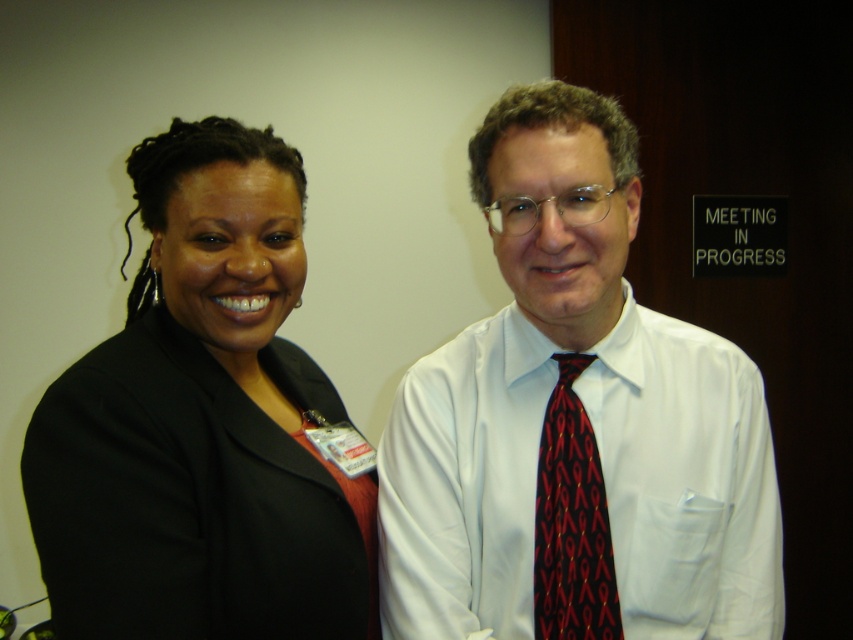
Question: Which is nearer to the white shirt and tie at center?

Choices:
 (A) black fabric jacket at left
 (B) red silk tie at center

Answer: (B)

Question: Which object appears closest to the camera in this image?

Choices:
 (A) black fabric jacket at left
 (B) white shirt and tie at center
 (C) red silk tie at center

Answer: (A)

Question: Is white shirt and tie at center above black fabric jacket at left?

Choices:
 (A) no
 (B) yes

Answer: (A)

Question: Is white shirt and tie at center positioned before black fabric jacket at left?

Choices:
 (A) yes
 (B) no

Answer: (B)

Question: Does white shirt and tie at center lie behind red silk tie at center?

Choices:
 (A) yes
 (B) no

Answer: (B)

Question: Estimate the real-world distances between objects in this image. Which object is closer to the red silk tie at center?

Choices:
 (A) white shirt and tie at center
 (B) black fabric jacket at left

Answer: (A)